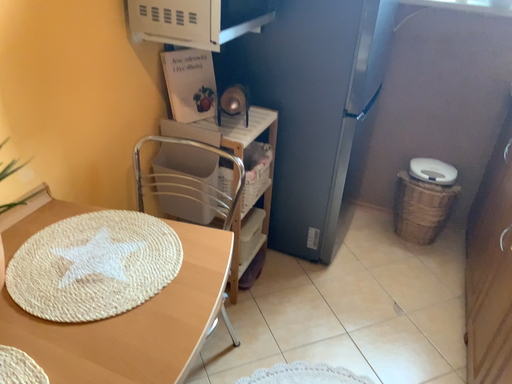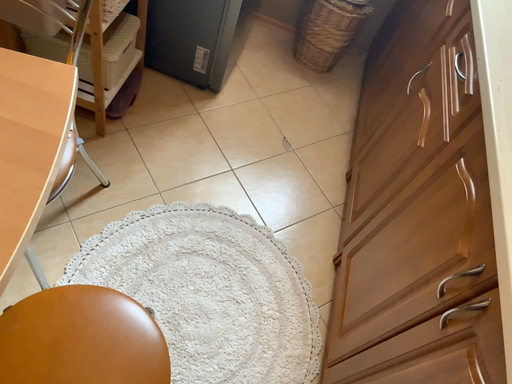
Question: How did the camera likely rotate when shooting the video?

Choices:
 (A) rotated downward
 (B) rotated upward

Answer: (A)